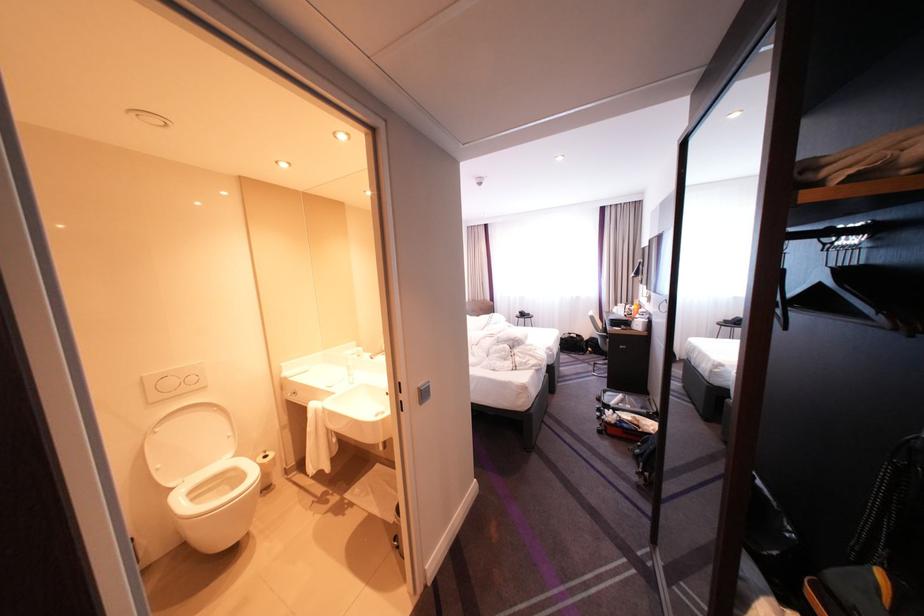
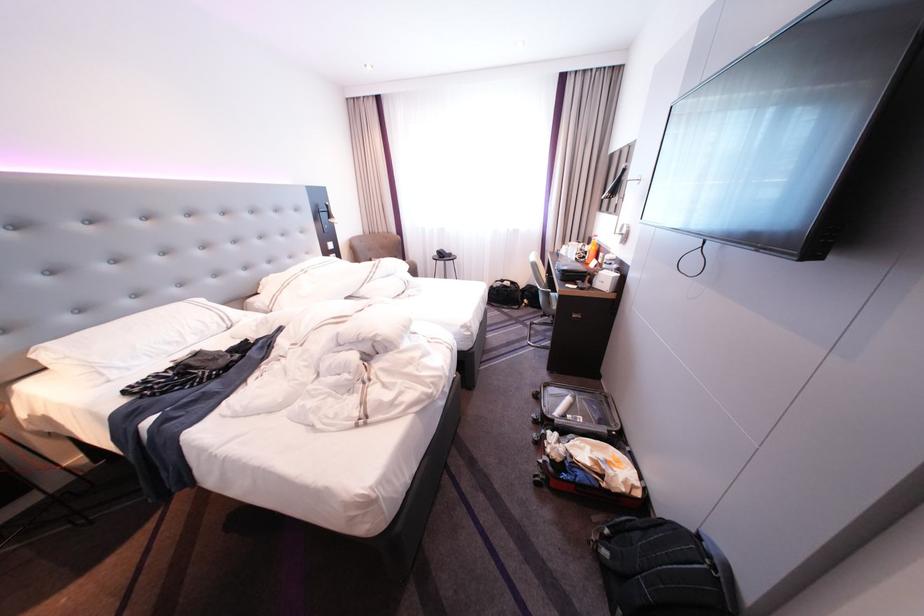
Based on the photo, which direction would the cameraman need to move to produce the second image?

The cameraman walked toward right, forward.